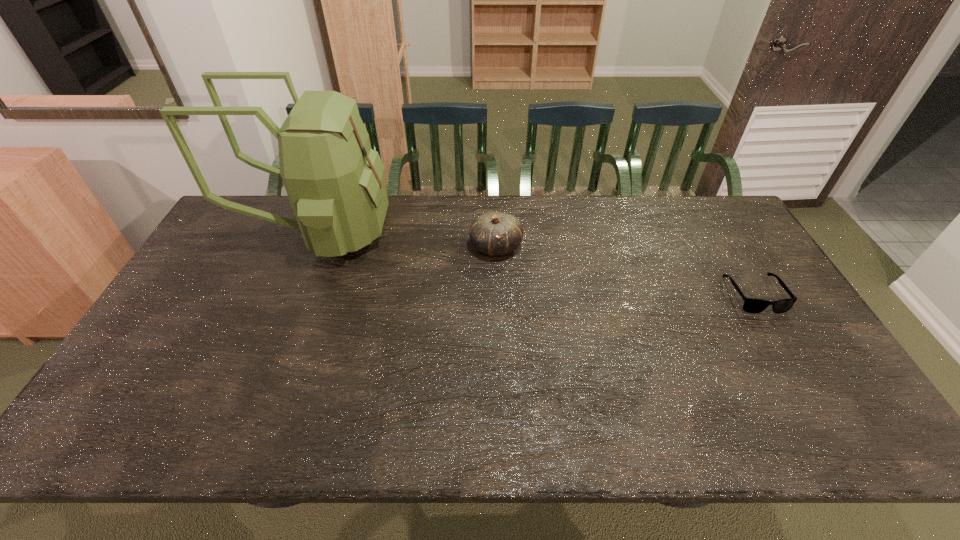
The width and height of the screenshot is (960, 540). I want to click on object that stands as the closest to the gourd, so click(335, 182).

The height and width of the screenshot is (540, 960). Identify the location of object that is the closest to the second object from left to right. (x=335, y=182).

I want to click on free space that satisfies the following two spatial constraints: 1. on the front pocket of the gourd; 2. on the right side of the leftmost object, so click(314, 247).

Identify the location of free space that satisfies the following two spatial constraints: 1. on the front pocket of the gourd; 2. on the left side of the backpack. This screenshot has height=540, width=960. (314, 247).

The image size is (960, 540). I want to click on free space that satisfies the following two spatial constraints: 1. on the front pocket of the leftmost object; 2. on the right side of the gourd, so click(x=314, y=247).

What are the coordinates of `vacant position in the image that satisfies the following two spatial constraints: 1. on the back side of the second tallest object; 2. on the front pocket of the tallest object` in the screenshot? It's located at (495, 232).

Where is `free space that satisfies the following two spatial constraints: 1. on the front pocket of the tallest object; 2. on the left side of the second object from right to left`? The height and width of the screenshot is (540, 960). free space that satisfies the following two spatial constraints: 1. on the front pocket of the tallest object; 2. on the left side of the second object from right to left is located at coordinates (314, 247).

I want to click on vacant space that satisfies the following two spatial constraints: 1. on the front pocket of the backpack; 2. on the back side of the second tallest object, so click(x=314, y=247).